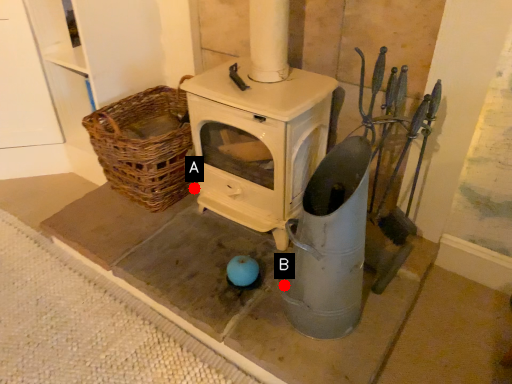
Question: Two points are circled on the image, labeled by A and B beside each circle. Which point is closer to the camera taking this photo?

Choices:
 (A) A is closer
 (B) B is closer

Answer: (B)